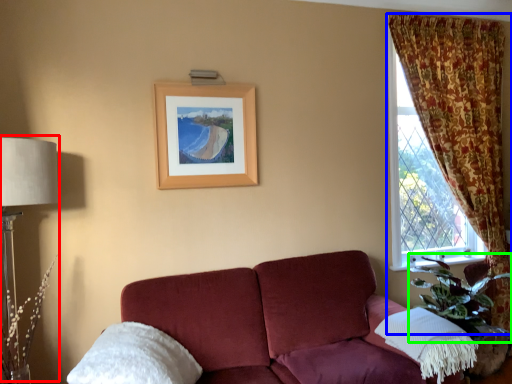
Question: Based on their relative distances, which object is nearer to table lamp (highlighted by a red box)? Choose from curtain (highlighted by a blue box) and plant (highlighted by a green box).

Choices:
 (A) curtain
 (B) plant

Answer: (B)